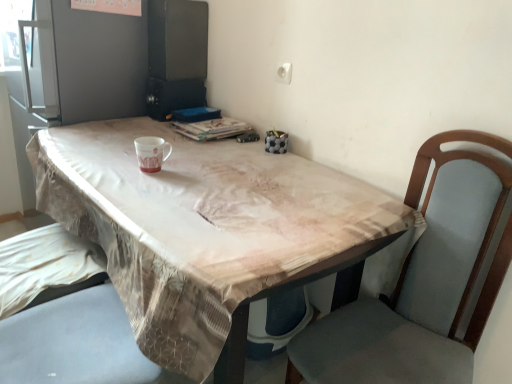
Locate an element on the screen. The height and width of the screenshot is (384, 512). vacant area that is in front of matte ceramic mug at center is located at coordinates (143, 190).